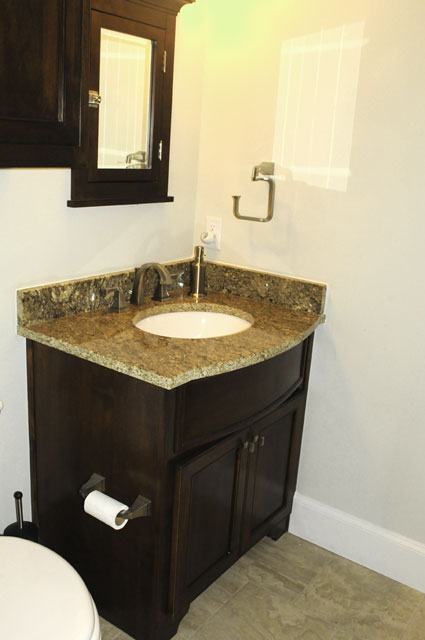
The height and width of the screenshot is (640, 425). Find the location of `sink`. sink is located at coordinates (186, 324).